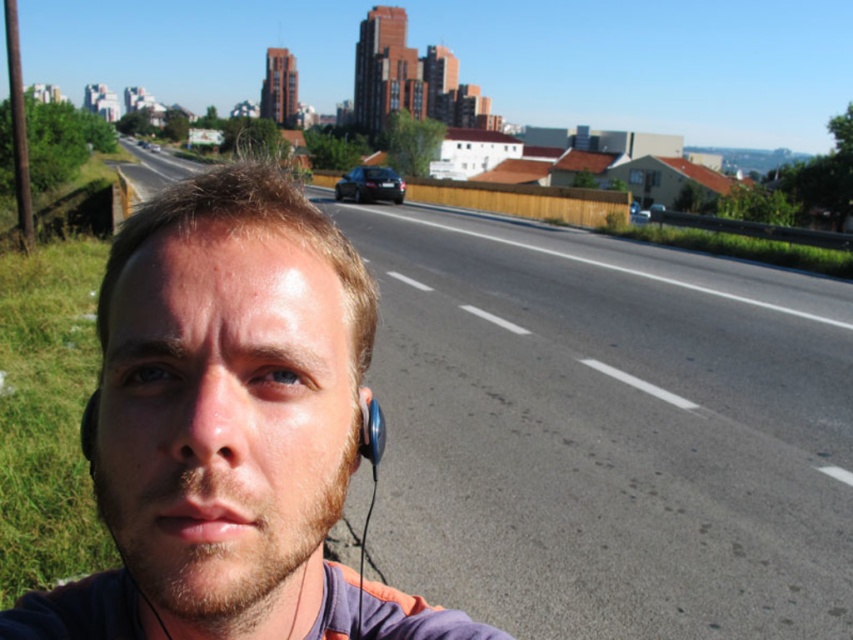
You are a photographer trying to capture a clear shot of the smooth skin face at center and the satin blue earphone at lower left. Based on their positions, which object would appear closer to the left edge of the photo?

The satin blue earphone at lower left is positioned to the right of the smooth skin face at center, so the smooth skin face at center would appear closer to the left edge of the photo.

You are a delivery drone operator. Your drone is currently at point (607, 432) which is above the asphalt road at center. You need to fly to the nearest grassy area to land safely. Which direction should you turn to reach the grassy area?

The point (607, 432) is above the asphalt road at center. The grassy area is to the left side of the road. Therefore, you should turn left to reach the grassy area for landing.